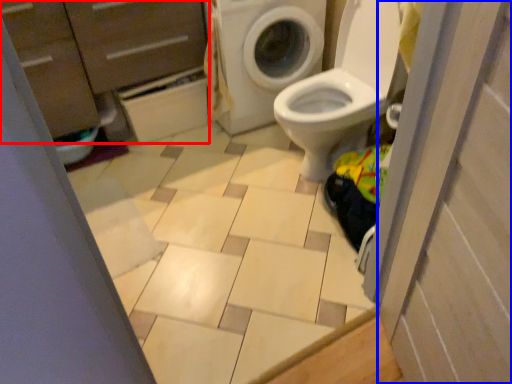
Question: Which object is further to the camera taking this photo, dresser (highlighted by a red box) or screen door (highlighted by a blue box)?

Choices:
 (A) dresser
 (B) screen door

Answer: (A)